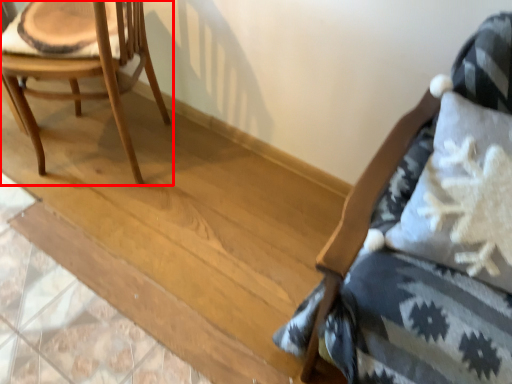
Question: From the image's perspective, what is the correct spatial positioning of chair (annotated by the red box) in reference to chair?

Choices:
 (A) above
 (B) below

Answer: (A)